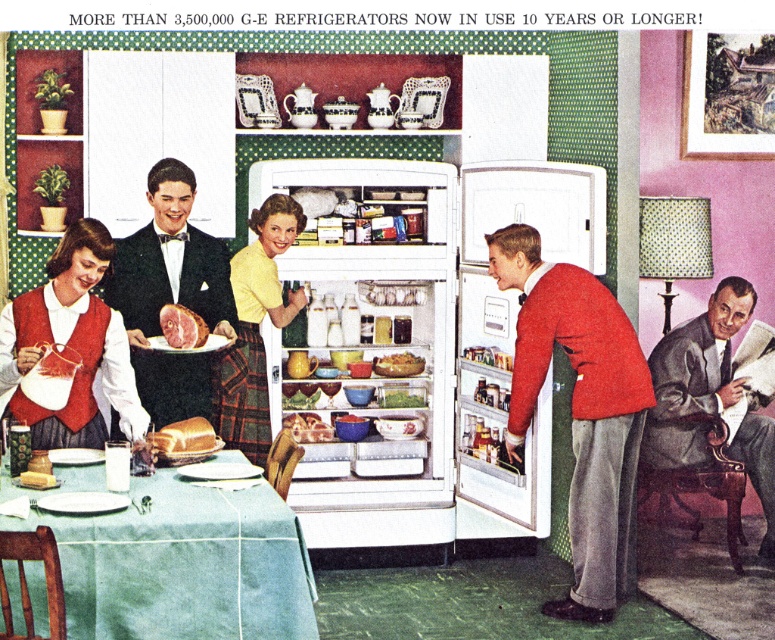
Question: Observing the image, what is the correct spatial positioning of yellow fabric skirt at center in reference to yellow glazed ceramic mug at center?

Choices:
 (A) above
 (B) below

Answer: (A)

Question: Is smooth gray suit at right smaller than shiny metallic can at center?

Choices:
 (A) yes
 (B) no

Answer: (B)

Question: Which point is closer to the camera?

Choices:
 (A) shiny metallic can at center
 (B) red wool sweater at center
 (C) brown leather stool at lower right
 (D) matte red vest at lower left

Answer: (D)

Question: Among these points, which one is farthest from the camera?

Choices:
 (A) (x=195, y=436)
 (B) (x=625, y=413)
 (C) (x=248, y=449)
 (D) (x=488, y=353)

Answer: (D)

Question: Is green matte bowl at center bigger than white creamy cheese at center?

Choices:
 (A) no
 (B) yes

Answer: (B)

Question: Based on their relative distances, which object is nearer to the translucent glass jar at center?

Choices:
 (A) yellow glazed ceramic mug at center
 (B) matte red vest at lower left
 (C) shiny metallic bowl at center

Answer: (C)